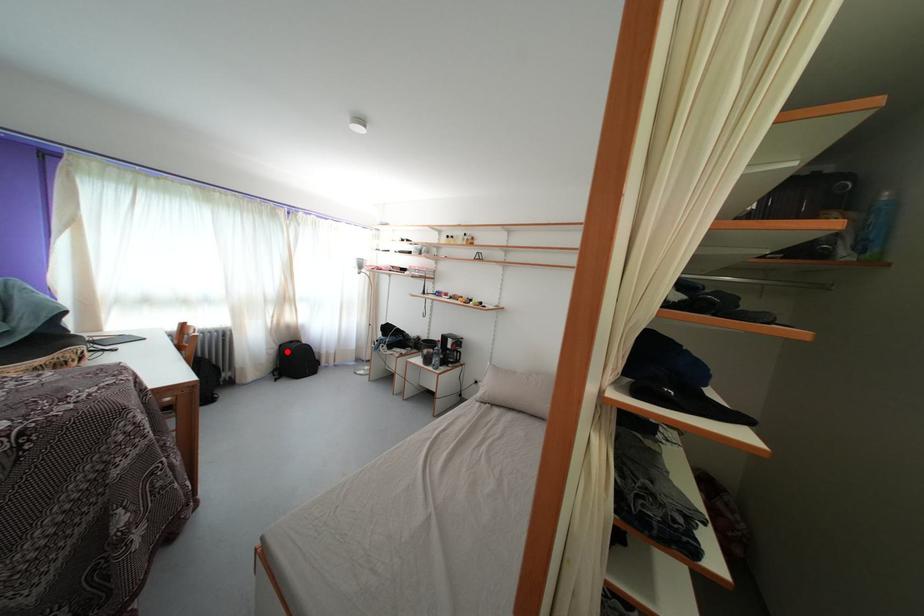
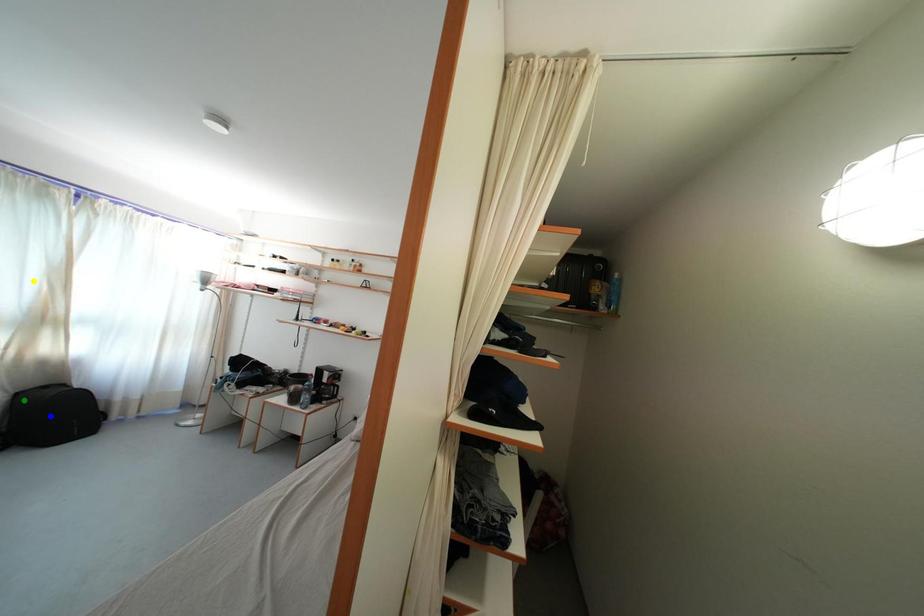
Question: I am providing you with two images of the same scene from different viewpoints. A red point is marked on the first image. You are given multiple points on the second image. In image 2, which mark is for the same physical point as the one in image 1?

Choices:
 (A) green point
 (B) yellow point
 (C) blue point

Answer: (A)